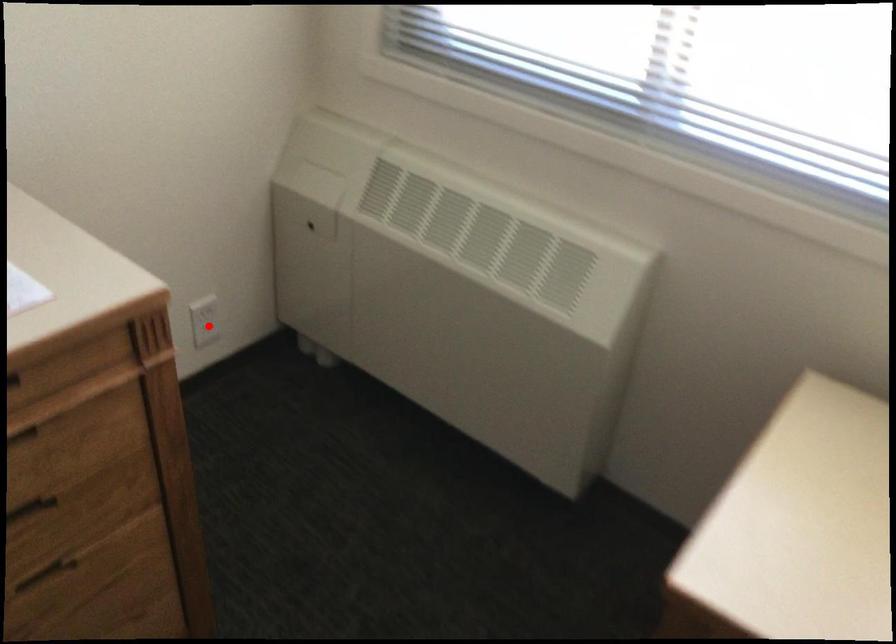
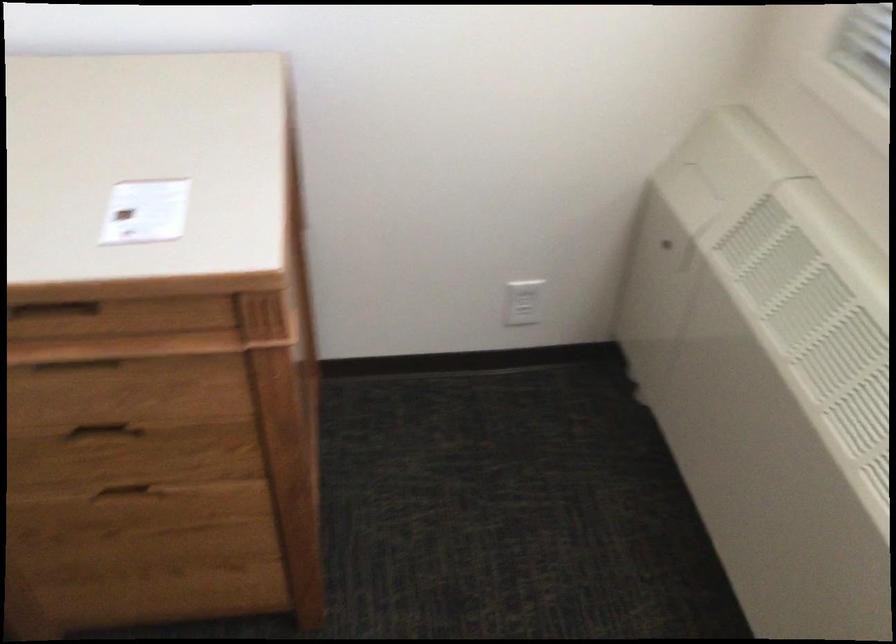
Question: I am providing you with two images of the same scene from different viewpoints. A red point is shown in image1. For the corresponding object point in image2, is it positioned nearer or farther from the camera?

Choices:
 (A) Nearer
 (B) Farther

Answer: (A)